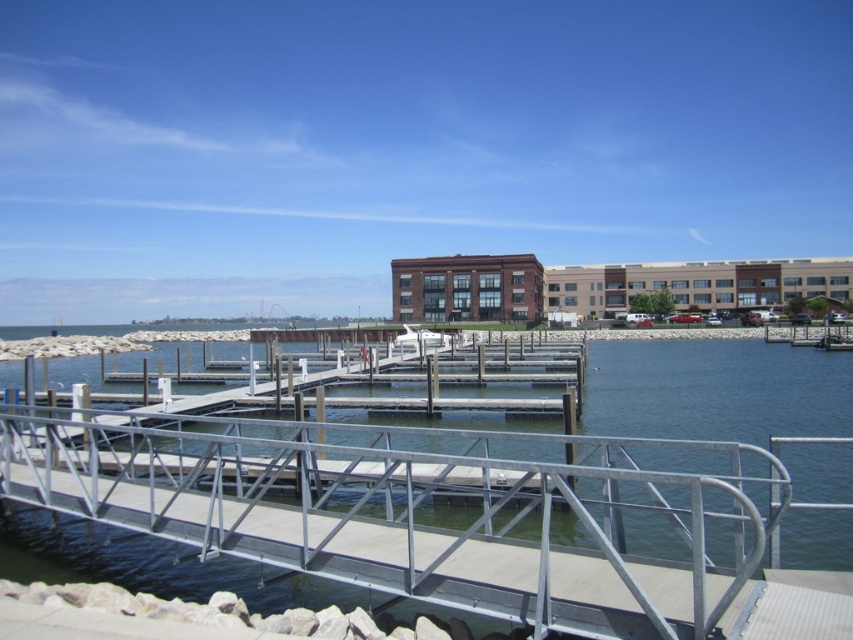
Question: Which object is closer to the camera taking this photo?

Choices:
 (A) white glossy boat at center
 (B) silver metallic rail at center

Answer: (B)

Question: Does silver metallic rail at center have a lesser width compared to white glossy boat at center?

Choices:
 (A) no
 (B) yes

Answer: (A)

Question: Is silver metallic rail at center further to camera compared to white glossy boat at center?

Choices:
 (A) yes
 (B) no

Answer: (B)

Question: Does silver metallic rail at center have a larger size compared to white glossy boat at center?

Choices:
 (A) yes
 (B) no

Answer: (A)